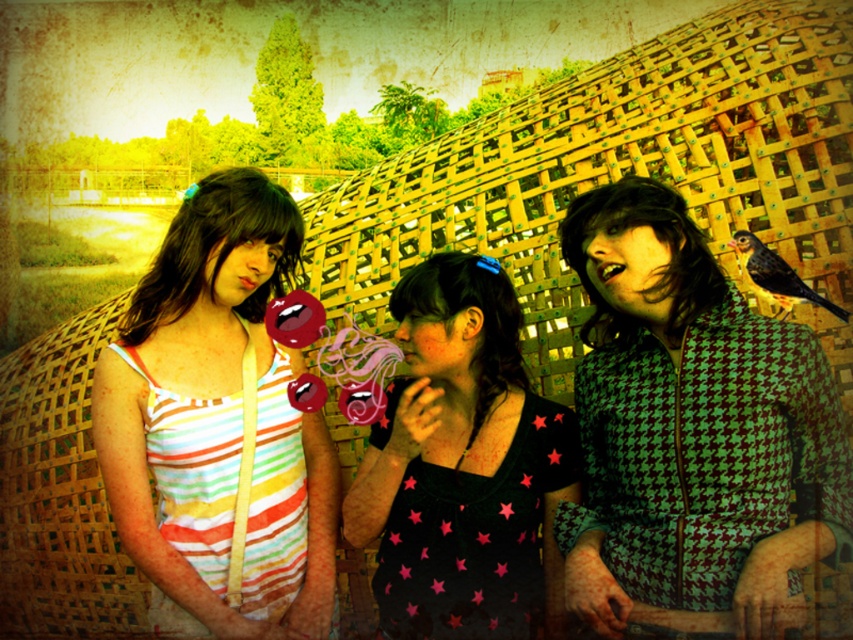
What do you see at coordinates (219, 426) in the screenshot? The height and width of the screenshot is (640, 853). I see `striped fabric dress at left` at bounding box center [219, 426].

Looking at this image, does striped fabric dress at left have a lesser height compared to black star-patterned shirt at center?

In fact, striped fabric dress at left may be taller than black star-patterned shirt at center.

Does point (277, 573) come farther from viewer compared to point (416, 452)?

That is True.

Find the location of `striped fabric dress at left`. striped fabric dress at left is located at coordinates (219, 426).

Can you confirm if green houndstooth coat at center is shorter than striped fabric dress at left?

Indeed, green houndstooth coat at center has a lesser height compared to striped fabric dress at left.

Is green houndstooth coat at center smaller than striped fabric dress at left?

No, green houndstooth coat at center is not smaller than striped fabric dress at left.

The height and width of the screenshot is (640, 853). In order to click on green houndstooth coat at center in this screenshot , I will do `click(691, 429)`.

Can you confirm if green houndstooth coat at center is taller than black star-patterned shirt at center?

Correct, green houndstooth coat at center is much taller as black star-patterned shirt at center.

Which of these two, green houndstooth coat at center or black star-patterned shirt at center, stands shorter?

Standing shorter between the two is black star-patterned shirt at center.

This screenshot has height=640, width=853. I want to click on green houndstooth coat at center, so click(691, 429).